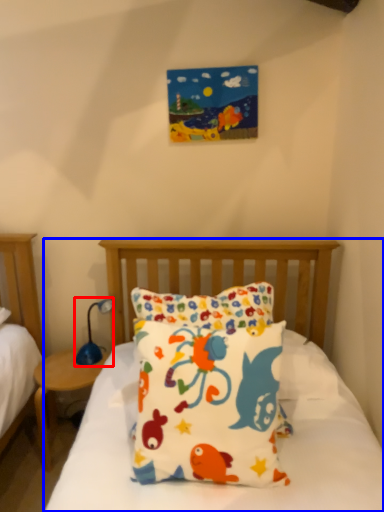
Question: Which object appears closest to the camera in this image, table lamp (highlighted by a red box) or bed (highlighted by a blue box)?

Choices:
 (A) table lamp
 (B) bed

Answer: (B)